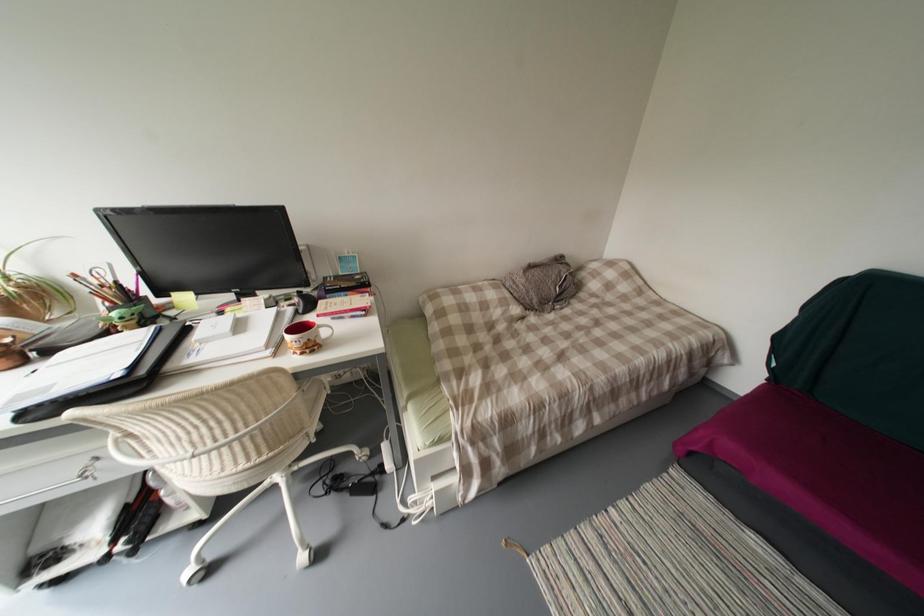
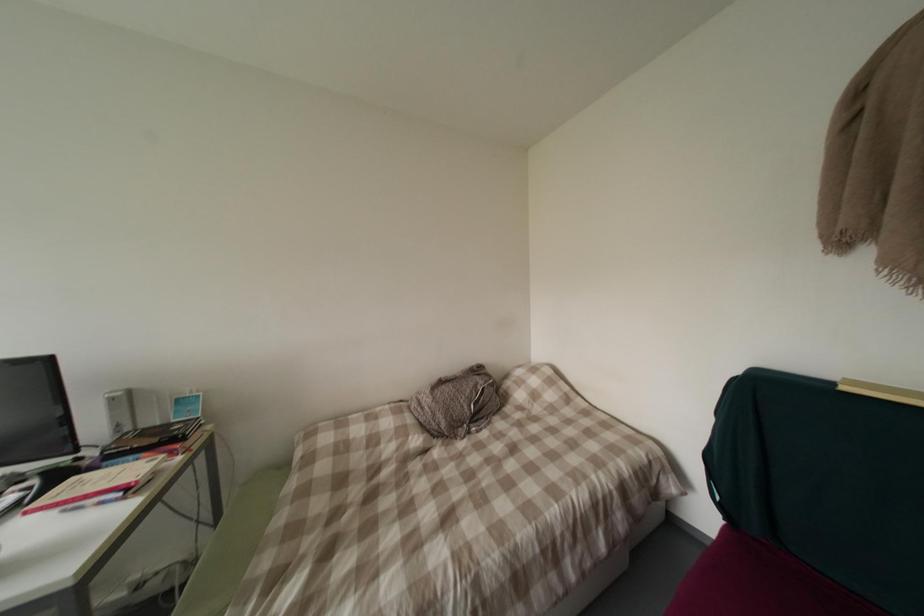
Question: What movement of the cameraman would produce the second image?

Choices:
 (A) Left
 (B) Right
 (C) Forward
 (D) Backward

Answer: (B)